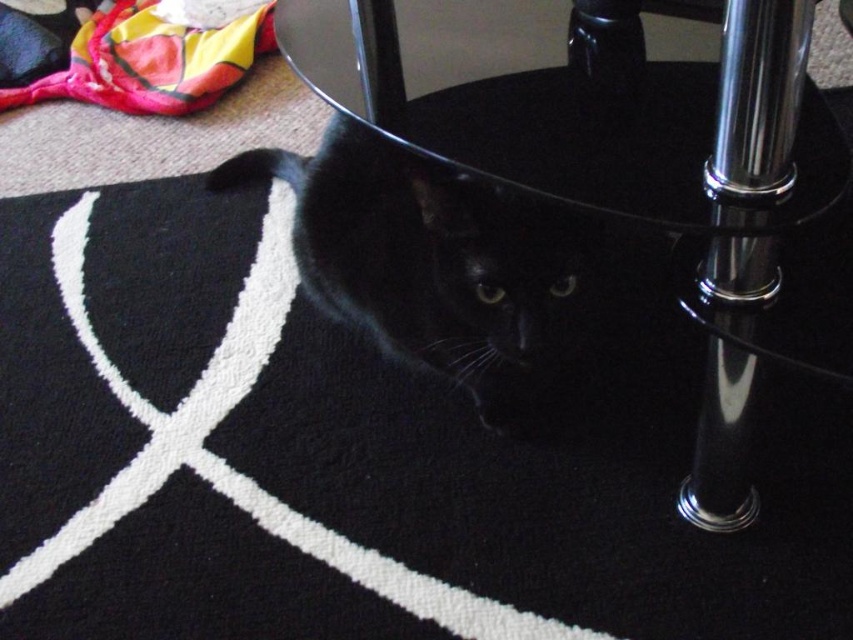
Question: From the image, what is the correct spatial relationship of transparent glass table at center in relation to black glossy cat at lower center?

Choices:
 (A) right
 (B) left

Answer: (A)

Question: Which point is closer to the camera taking this photo?

Choices:
 (A) (355, 284)
 (B) (556, 22)

Answer: (B)

Question: Is transparent glass table at center to the left of black glossy cat at lower center from the viewer's perspective?

Choices:
 (A) yes
 (B) no

Answer: (B)

Question: From the image, what is the correct spatial relationship of transparent glass table at center in relation to black glossy cat at lower center?

Choices:
 (A) below
 (B) above

Answer: (B)